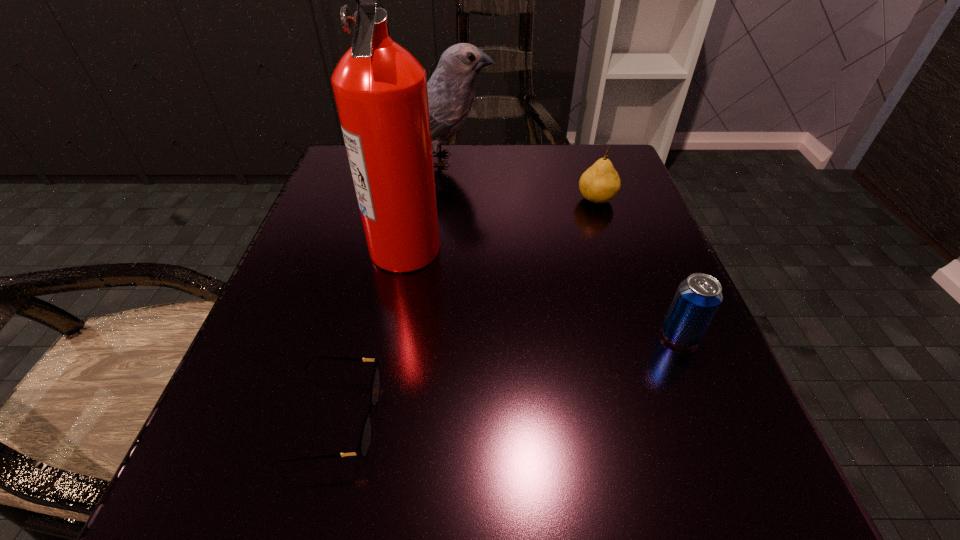
This screenshot has height=540, width=960. Find the location of `the tallest object`. the tallest object is located at coordinates (380, 89).

You are a GUI agent. You are given a task and a screenshot of the screen. Output one action in this format:
    pyautogui.click(x=<x>, y=<y>)
    Task: Click on the third nearest object
    
    Given the screenshot: What is the action you would take?
    pyautogui.click(x=380, y=89)

Locate an element on the screen. the farthest object is located at coordinates (451, 90).

At what (x,y) coordinates should I click in order to perform the action: click on the second tallest object. Please return your answer as a coordinate pair (x, y). This screenshot has width=960, height=540. Looking at the image, I should click on (451, 90).

The image size is (960, 540). In order to click on the fourth nearest object in this screenshot , I will do `click(600, 183)`.

Where is `beer can`? This screenshot has width=960, height=540. beer can is located at coordinates (698, 297).

What are the coordinates of `the nearest object` in the screenshot? It's located at (362, 448).

Find the location of a particular element. spectacles is located at coordinates (362, 448).

Where is `vacant region located at the nozzle of the fire extinguisher`? This screenshot has width=960, height=540. vacant region located at the nozzle of the fire extinguisher is located at coordinates (525, 248).

I want to click on vacant space located 0.220m on the front-facing side of the farthest object, so tap(589, 160).